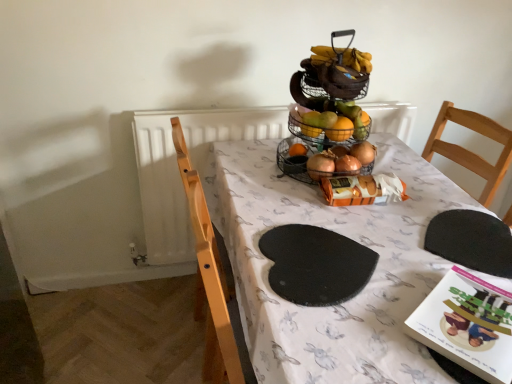
Question: Is black rubber placemat at lower right, positioned as the 2th mat in left-to-right order, at the right side of white fabric table at center?

Choices:
 (A) yes
 (B) no

Answer: (A)

Question: Can you confirm if black rubber placemat at lower right, positioned as the 2th mat in left-to-right order, is positioned to the left of white fabric table at center?

Choices:
 (A) no
 (B) yes

Answer: (A)

Question: Is black rubber placemat at lower right, which is counted as the first mat, starting from the right, with white fabric table at center?

Choices:
 (A) no
 (B) yes

Answer: (A)

Question: From a real-world perspective, is black rubber placemat at lower right, which is counted as the first mat, starting from the right, positioned under white fabric table at center based on gravity?

Choices:
 (A) yes
 (B) no

Answer: (B)

Question: Is black rubber placemat at lower right, positioned as the 2th mat in left-to-right order, positioned before white fabric table at center?

Choices:
 (A) no
 (B) yes

Answer: (A)

Question: Does point (508, 263) appear closer or farther from the camera than point (475, 273)?

Choices:
 (A) closer
 (B) farther

Answer: (B)

Question: Considering the positions of black rubber placemat at lower right, positioned as the 2th mat in left-to-right order, and white fabric table at center in the image, is black rubber placemat at lower right, positioned as the 2th mat in left-to-right order, wider or thinner than white fabric table at center?

Choices:
 (A) wide
 (B) thin

Answer: (B)

Question: Is black rubber placemat at lower right, which is counted as the first mat, starting from the right, in front of or behind white fabric table at center in the image?

Choices:
 (A) front
 (B) behind

Answer: (B)

Question: Is black rubber placemat at lower right, which is counted as the first mat, starting from the right, taller or shorter than white fabric table at center?

Choices:
 (A) short
 (B) tall

Answer: (A)

Question: Based on their positions, is white paper book at lower right located to the left or right of white fabric table at center?

Choices:
 (A) right
 (B) left

Answer: (A)

Question: Looking at their shapes, would you say white paper book at lower right is wider or thinner than white fabric table at center?

Choices:
 (A) thin
 (B) wide

Answer: (A)

Question: Which is correct: white paper book at lower right is inside white fabric table at center, or outside of it?

Choices:
 (A) inside
 (B) outside

Answer: (A)

Question: Based on their sizes in the image, would you say white paper book at lower right is bigger or smaller than white fabric table at center?

Choices:
 (A) big
 (B) small

Answer: (B)

Question: Does point (472, 243) appear closer or farther from the camera than point (273, 274)?

Choices:
 (A) farther
 (B) closer

Answer: (A)

Question: Is black rubber placemat at lower right, positioned as the 2th mat in left-to-right order, spatially inside black felt mat at center, which ranks as the first mat in left-to-right order, or outside of it?

Choices:
 (A) inside
 (B) outside

Answer: (B)